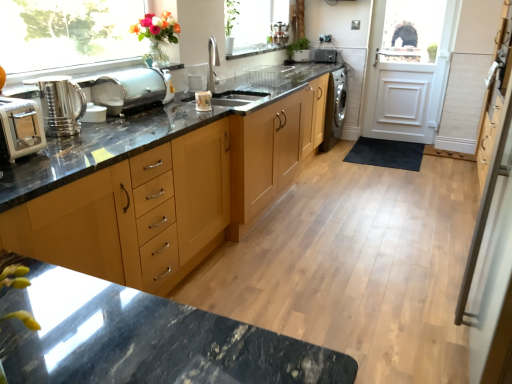
Find the location of `free space to the back side of silver metallic screen door at right`. free space to the back side of silver metallic screen door at right is located at coordinates (408, 281).